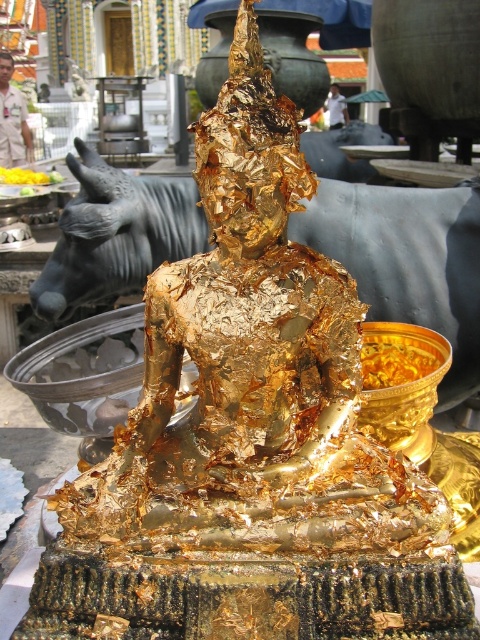
Question: Which point appears farthest from the camera in this image?

Choices:
 (A) (112, 289)
 (B) (407, 358)

Answer: (A)

Question: Does black polished stone bull at center come in front of yellow flower petals at center?

Choices:
 (A) no
 (B) yes

Answer: (B)

Question: Which of the following is the farthest from the observer?

Choices:
 (A) black polished stone bull at center
 (B) yellow flower petals at center
 (C) gold flake food at center

Answer: (B)

Question: Does black polished stone bull at center appear on the right side of yellow flower petals at center?

Choices:
 (A) no
 (B) yes

Answer: (B)

Question: Which object appears closest to the camera in this image?

Choices:
 (A) black polished stone bull at center
 (B) yellow flower petals at center
 (C) gold flake food at center

Answer: (C)

Question: Does black polished stone bull at center lie behind gold flake food at center?

Choices:
 (A) yes
 (B) no

Answer: (A)